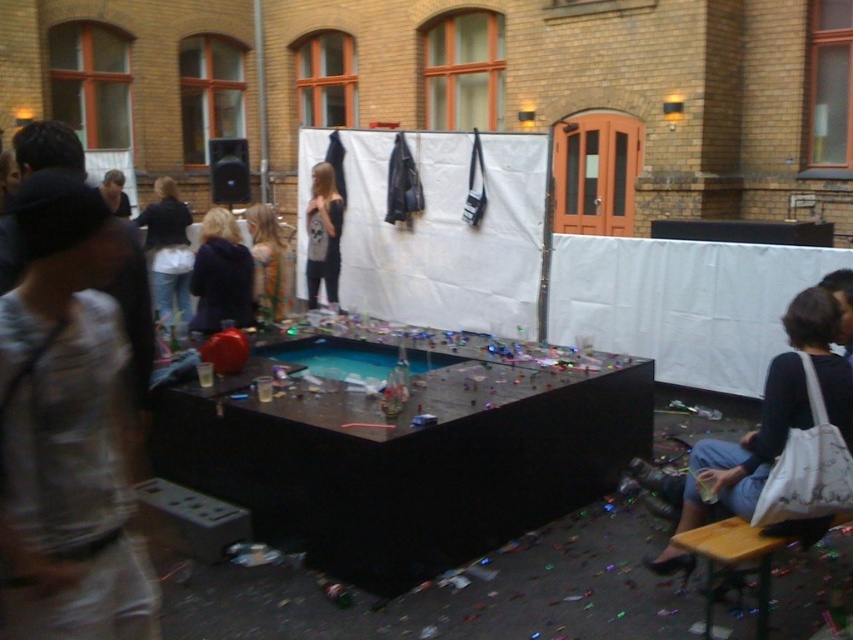
You are a party planner who needs to place a new decoration between the white fabric bag at lower right and the shiny gold hair at center. Given that the decoration requires at least 4 meters of space between them, will there be enough room?

The white fabric bag at lower right and the shiny gold hair at center are 3.99 meters apart from each other. Since the required space is 4 meters, there is not enough room to place the decoration between them.

Looking at this image, you are standing at the entrance of the yellow brick building and want to reach a specific point in the scene. The point you need to reach is located at coordinates point [233,243]. Given that you are 1.7 meters tall, will you be able to see the point without moving your head up or down?

The point [233,243] is 5.86 meters away from the viewer. Since the distance is horizontal and your height is 1.7 meters, the vertical angle needed to see the point would depend on its elevation. However, the description does not provide elevation data, so we cannot determine if you can see it without moving your head.